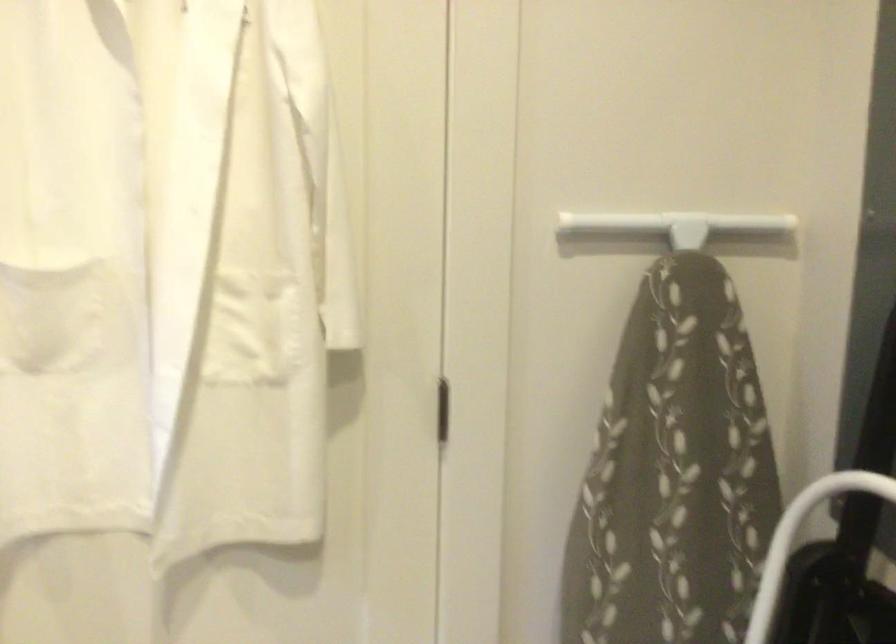
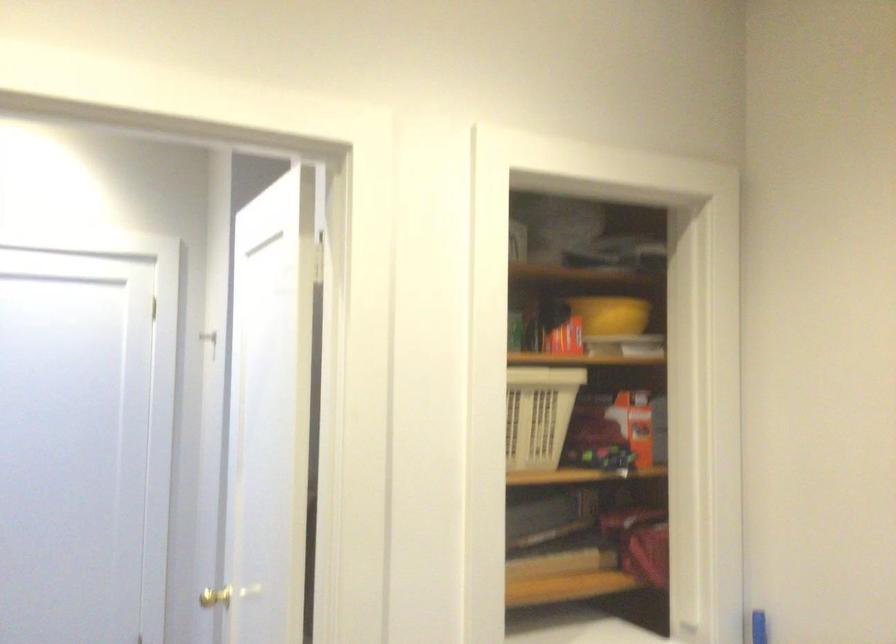
Question: The camera is either moving clockwise (left) or counter-clockwise (right) around the object. The first image is from the beginning of the video and the second image is from the end. Is the camera moving left or right when shooting the video?

Choices:
 (A) Left
 (B) Right

Answer: (A)